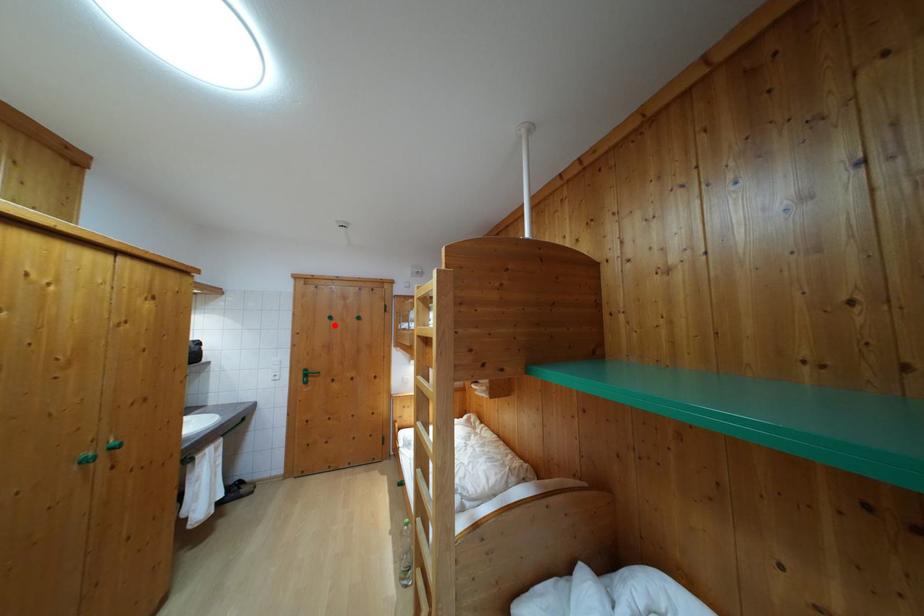
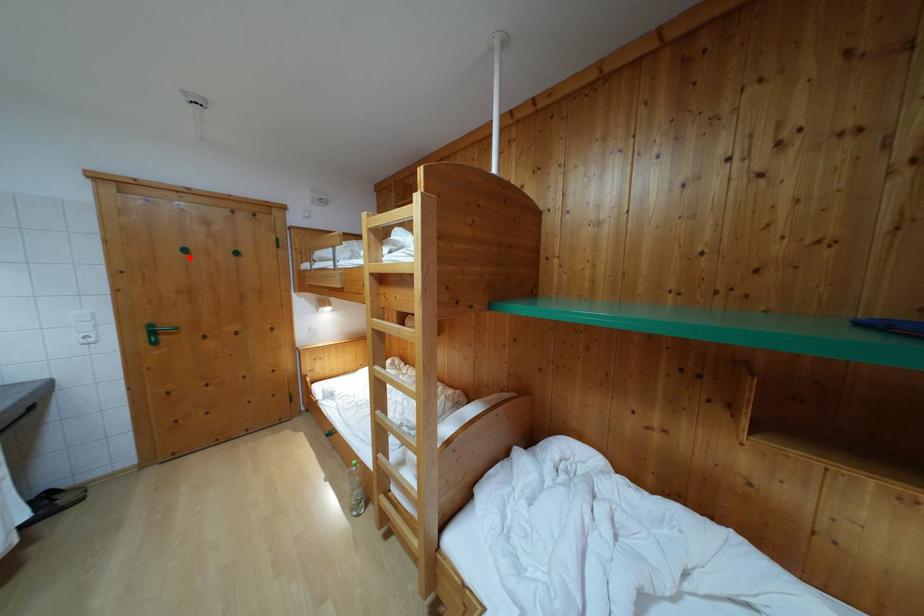
I am providing you with two images of the same scene from different viewpoints. A red point is marked on the first image and another point is marked on the second image. Do the highlighted points in image1 and image2 indicate the same real-world spot?

Yes